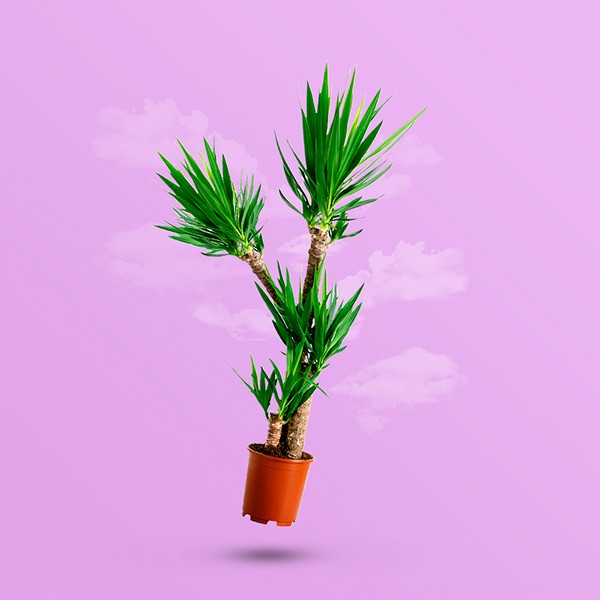
Find the location of a particular element. shadow of the plant pot is located at coordinates pyautogui.click(x=275, y=555).